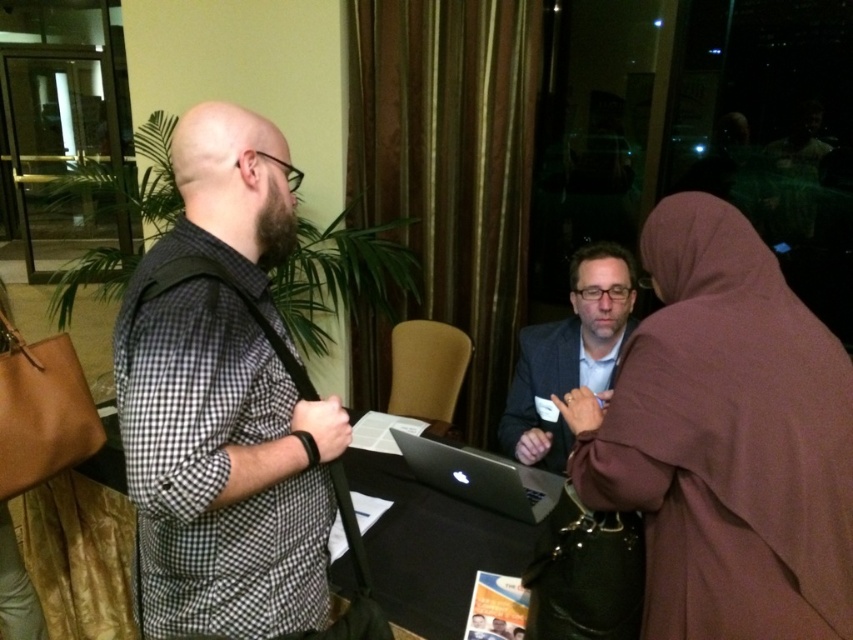
In the scene shown: Is checkered fabric shirt at left wider than silver metallic laptop at center?

Incorrect, checkered fabric shirt at left's width does not surpass silver metallic laptop at center's.

Locate an element on the screen. The width and height of the screenshot is (853, 640). checkered fabric shirt at left is located at coordinates (224, 403).

Who is positioned more to the right, brown fabric robe at right or checkered fabric shirt at left?

From the viewer's perspective, brown fabric robe at right appears more on the right side.

Between brown fabric robe at right and checkered fabric shirt at left, which one appears on the left side from the viewer's perspective?

From the viewer's perspective, checkered fabric shirt at left appears more on the left side.

What do you see at coordinates (726, 440) in the screenshot? The width and height of the screenshot is (853, 640). I see `brown fabric robe at right` at bounding box center [726, 440].

You are a GUI agent. You are given a task and a screenshot of the screen. Output one action in this format:
    pyautogui.click(x=<x>, y=<y>)
    Task: Click on the brown fabric robe at right
    This screenshot has height=640, width=853.
    Given the screenshot: What is the action you would take?
    pyautogui.click(x=726, y=440)

In the scene shown: Is matte black suit at center thinner than silver metallic laptop at center?

Indeed, matte black suit at center has a lesser width compared to silver metallic laptop at center.

From the picture: Which of these two, matte black suit at center or silver metallic laptop at center, stands shorter?

silver metallic laptop at center

Where is `matte black suit at center`? matte black suit at center is located at coordinates (569, 353).

You are a GUI agent. You are given a task and a screenshot of the screen. Output one action in this format:
    pyautogui.click(x=<x>, y=<y>)
    Task: Click on the matte black suit at center
    Image resolution: width=853 pixels, height=640 pixels.
    Given the screenshot: What is the action you would take?
    pyautogui.click(x=569, y=353)